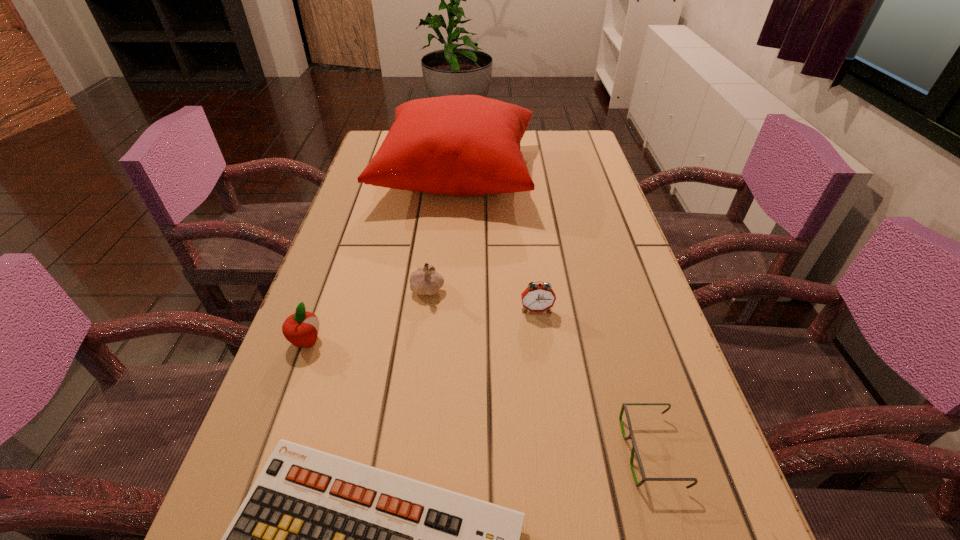
At what (x,y) coordinates should I click in order to perform the action: click on vacant space at the right edge. Please return your answer as a coordinate pair (x, y). This screenshot has width=960, height=540. Looking at the image, I should click on (591, 187).

Locate an element on the screen. This screenshot has height=540, width=960. vacant region at the far right corner is located at coordinates (542, 144).

You are a GUI agent. You are given a task and a screenshot of the screen. Output one action in this format:
    pyautogui.click(x=<x>, y=<y>)
    Task: Click on the free space between the third nearest object and the fifth tallest object
    This screenshot has width=960, height=540.
    Given the screenshot: What is the action you would take?
    pyautogui.click(x=479, y=396)

Find the location of a particular element. This screenshot has width=960, height=540. free space between the spectacles and the apple is located at coordinates (479, 396).

Image resolution: width=960 pixels, height=540 pixels. Find the location of `free spot between the farthest object and the third nearest object`. free spot between the farthest object and the third nearest object is located at coordinates (381, 258).

The width and height of the screenshot is (960, 540). In order to click on vacant area that lies between the fourth nearest object and the garlic in this screenshot , I will do `click(482, 299)`.

Identify the location of vacant space in between the rightmost object and the farthest object. The width and height of the screenshot is (960, 540). (554, 313).

Select which object is the closest to the second farthest object. Please provide its 2D coordinates. Your answer should be formatted as a tuple, i.e. [(x, y)], where the tuple contains the x and y coordinates of a point satisfying the conditions above.

[(539, 297)]

Choose which object is the second nearest neighbor to the cushion. Please provide its 2D coordinates. Your answer should be formatted as a tuple, i.e. [(x, y)], where the tuple contains the x and y coordinates of a point satisfying the conditions above.

[(539, 297)]

This screenshot has width=960, height=540. In order to click on free space that satisfies the following two spatial constraints: 1. on the back side of the apple; 2. on the right side of the farthest object in this screenshot , I will do `click(368, 174)`.